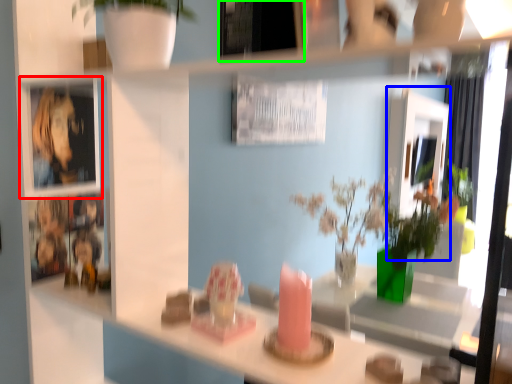
Question: Which object is the farthest from cabinet (highlighted by a red box)? Choose among these: mirror (highlighted by a blue box) or picture frame (highlighted by a green box).

Choices:
 (A) mirror
 (B) picture frame

Answer: (A)